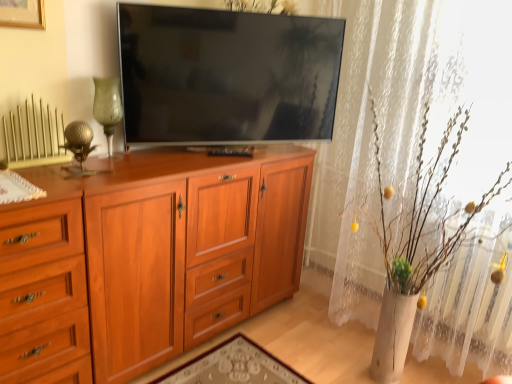
Question: Is gold metallic radiator at upper left to the left of light brown wood cabinet at center from the viewer's perspective?

Choices:
 (A) yes
 (B) no

Answer: (A)

Question: Considering the relative sizes of gold metallic radiator at upper left and light brown wood cabinet at center in the image provided, is gold metallic radiator at upper left thinner than light brown wood cabinet at center?

Choices:
 (A) no
 (B) yes

Answer: (B)

Question: Is gold metallic radiator at upper left at the right side of light brown wood cabinet at center?

Choices:
 (A) yes
 (B) no

Answer: (B)

Question: From the image's perspective, would you say gold metallic radiator at upper left is positioned over light brown wood cabinet at center?

Choices:
 (A) yes
 (B) no

Answer: (A)

Question: Is the position of gold metallic radiator at upper left less distant than that of light brown wood cabinet at center?

Choices:
 (A) no
 (B) yes

Answer: (A)

Question: From a real-world perspective, is light brown wood cabinet at center physically located above or below brushed gold picture frame at upper left?

Choices:
 (A) below
 (B) above

Answer: (A)

Question: Is point (250, 264) positioned closer to the camera than point (28, 23)?

Choices:
 (A) closer
 (B) farther

Answer: (B)

Question: Relative to brushed gold picture frame at upper left, is light brown wood cabinet at center in front or behind?

Choices:
 (A) behind
 (B) front

Answer: (A)

Question: From the image's perspective, relative to brushed gold picture frame at upper left, is light brown wood cabinet at center above or below?

Choices:
 (A) above
 (B) below

Answer: (B)

Question: Based on their sizes in the image, would you say light brown wood drawer at left is bigger or smaller than flat screen tv at center?

Choices:
 (A) big
 (B) small

Answer: (A)

Question: Considering their positions, is light brown wood drawer at left located in front of or behind flat screen tv at center?

Choices:
 (A) behind
 (B) front

Answer: (B)

Question: From the image's perspective, relative to flat screen tv at center, is light brown wood drawer at left above or below?

Choices:
 (A) above
 (B) below

Answer: (B)

Question: From a real-world perspective, is light brown wood drawer at left positioned above or below flat screen tv at center?

Choices:
 (A) above
 (B) below

Answer: (B)

Question: From the image's perspective, is white lace curtain at upper right positioned above or below light brown wood drawer at left?

Choices:
 (A) above
 (B) below

Answer: (A)

Question: Is white lace curtain at upper right inside the boundaries of light brown wood drawer at left, or outside?

Choices:
 (A) outside
 (B) inside

Answer: (A)